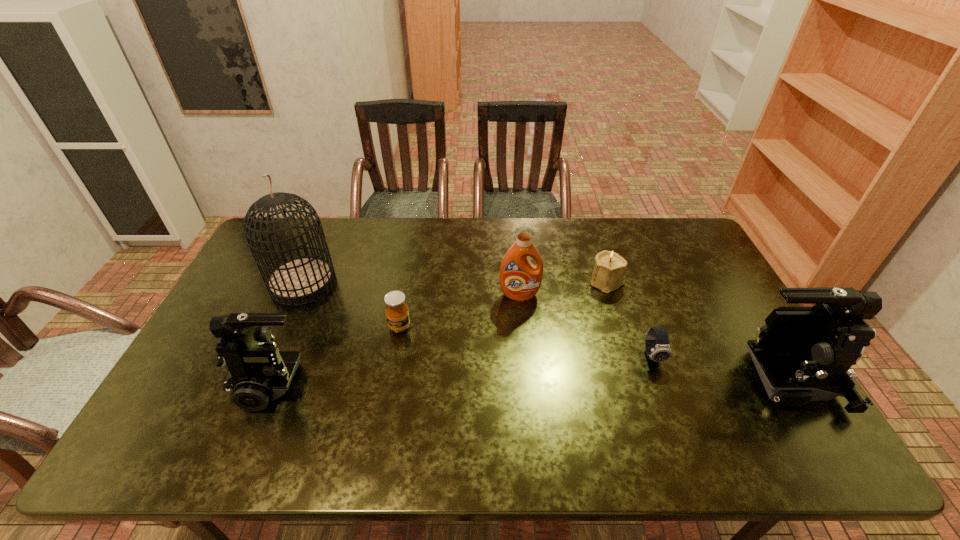
Locate an element on the screen. blank region between the candle_holder and the tallest object is located at coordinates (455, 283).

At what (x,y) coordinates should I click in order to perform the action: click on vacant space that's between the sixth tallest object and the candle_holder. Please return your answer as a coordinate pair (x, y). The width and height of the screenshot is (960, 540). Looking at the image, I should click on (503, 305).

In order to click on free space that is in between the fourth object from right to left and the tallest object in this screenshot , I will do `click(411, 289)`.

At what (x,y) coordinates should I click in order to perform the action: click on vacant point located between the left camcorder and the candle_holder. Please return your answer as a coordinate pair (x, y). The width and height of the screenshot is (960, 540). Looking at the image, I should click on (440, 332).

Where is `free space that is in between the birdcage and the shorter camcorder`? free space that is in between the birdcage and the shorter camcorder is located at coordinates (288, 332).

Where is `vacant point located between the shorter camcorder and the second tallest object`? The height and width of the screenshot is (540, 960). vacant point located between the shorter camcorder and the second tallest object is located at coordinates (528, 381).

The image size is (960, 540). In order to click on free space between the shortest object and the rightmost object in this screenshot , I will do click(718, 368).

Select which object is the fourth closest to the detergent. Please provide its 2D coordinates. Your answer should be formatted as a tuple, i.e. [(x, y)], where the tuple contains the x and y coordinates of a point satisfying the conditions above.

[(802, 354)]

Choose which object is the nearest neighbor to the right camcorder. Please provide its 2D coordinates. Your answer should be formatted as a tuple, i.e. [(x, y)], where the tuple contains the x and y coordinates of a point satisfying the conditions above.

[(657, 346)]

Find the location of `free space that satisfies the following two spatial constraints: 1. on the front-facing side of the third object from left to right; 2. on the lens mount of the left camcorder`. free space that satisfies the following two spatial constraints: 1. on the front-facing side of the third object from left to right; 2. on the lens mount of the left camcorder is located at coordinates (390, 381).